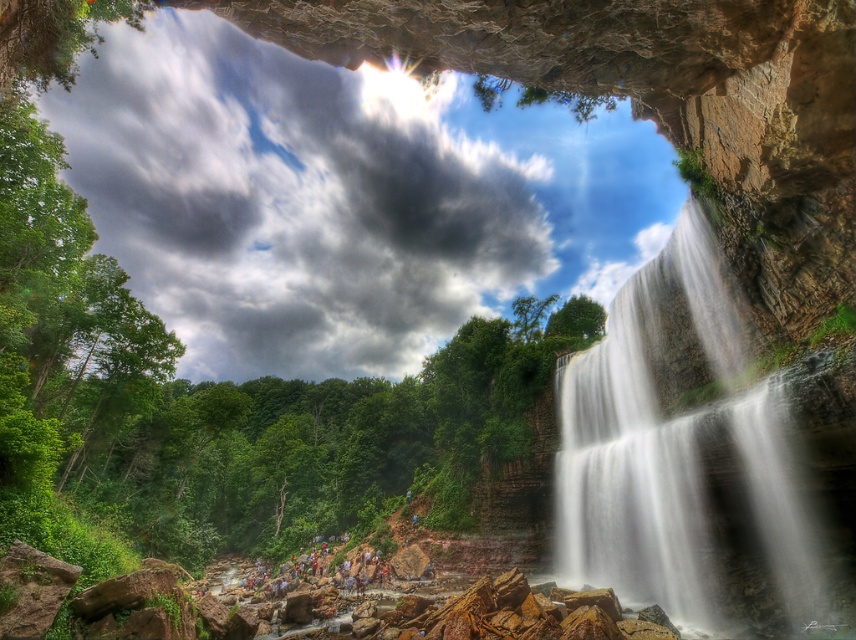
Does white textured water at right have a greater width compared to multicolored clothing at center?

No, white textured water at right is not wider than multicolored clothing at center.

Does white textured water at right come behind multicolored clothing at center?

No, it is not.

Between point (664, 422) and point (277, 589), which one is positioned in front?

Point (664, 422) is more forward.

Locate an element on the screen. The image size is (856, 640). white textured water at right is located at coordinates (676, 445).